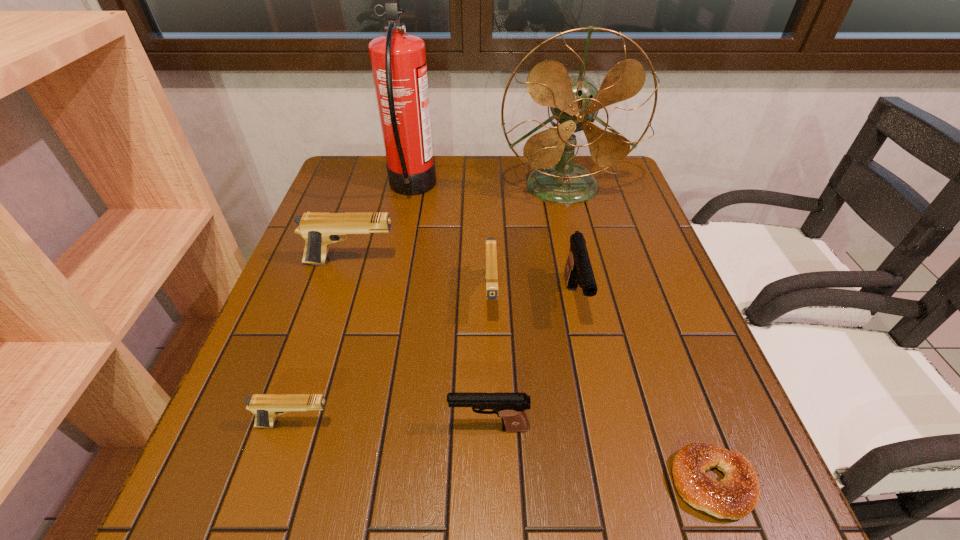
I want to click on fire extinguisher, so click(x=398, y=60).

The height and width of the screenshot is (540, 960). Identify the location of fan. (574, 100).

You are a GUI agent. You are given a task and a screenshot of the screen. Output one action in this format:
    pyautogui.click(x=<x>, y=<y>)
    Task: Click on the third farthest object
    The image size is (960, 540).
    Given the screenshot: What is the action you would take?
    pyautogui.click(x=319, y=229)

The image size is (960, 540). Find the location of `the biggest tan pistol`. the biggest tan pistol is located at coordinates (319, 229).

Locate an element on the screen. This screenshot has height=540, width=960. the bigger black pistol is located at coordinates (578, 270).

Locate an element on the screen. the farther black pistol is located at coordinates (578, 270).

In order to click on the rightmost tan pistol in this screenshot , I will do `click(491, 274)`.

Locate an element on the screen. The width and height of the screenshot is (960, 540). the second nearest tan pistol is located at coordinates click(x=491, y=274).

Identify the location of the smaller black pistol. (510, 407).

Identify the location of the left black pistol. This screenshot has height=540, width=960. (510, 407).